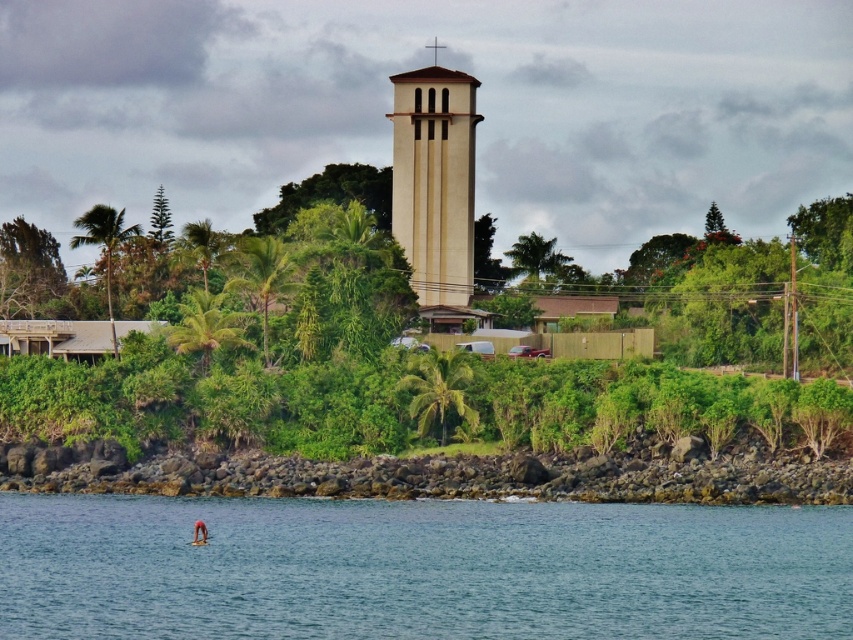
From the picture: You are standing on the rocky shoreline and want to reach the green leafy shrubs at center. Which direction should you walk to avoid the clear blue water at lower center?

You should walk away from the clear blue water at lower center towards the land since the shrubs are behind the water.

You are standing at the point marked by point [419,568] in the coastal scene. What type of environment are you currently in?

You are in the clear blue water at lower center, as indicated by the point [419,568].